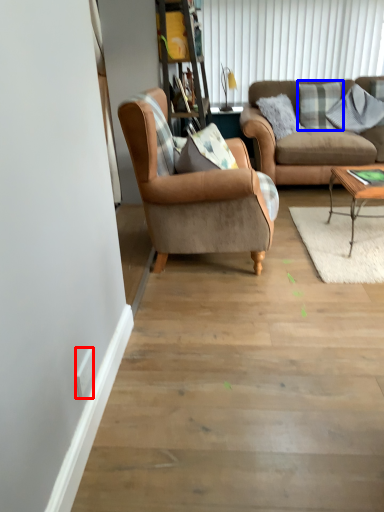
Question: Which object is closer to the camera taking this photo, power outlet (highlighted by a red box) or pillow (highlighted by a blue box)?

Choices:
 (A) power outlet
 (B) pillow

Answer: (A)